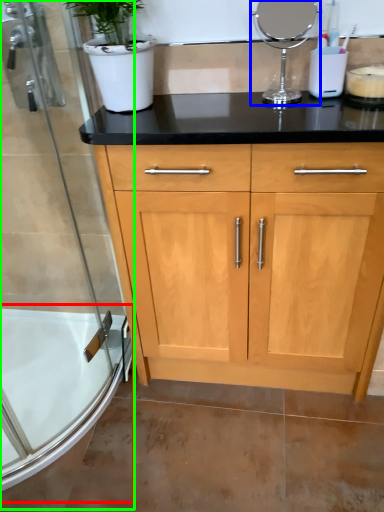
Question: Which is nearer to the bath (highlighted by a red box)? appliance (highlighted by a blue box) or shower door (highlighted by a green box).

Choices:
 (A) appliance
 (B) shower door

Answer: (B)